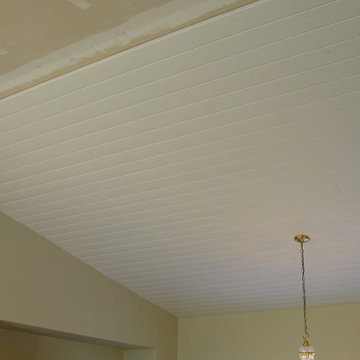
Identify the location of yellow column. (166, 356).